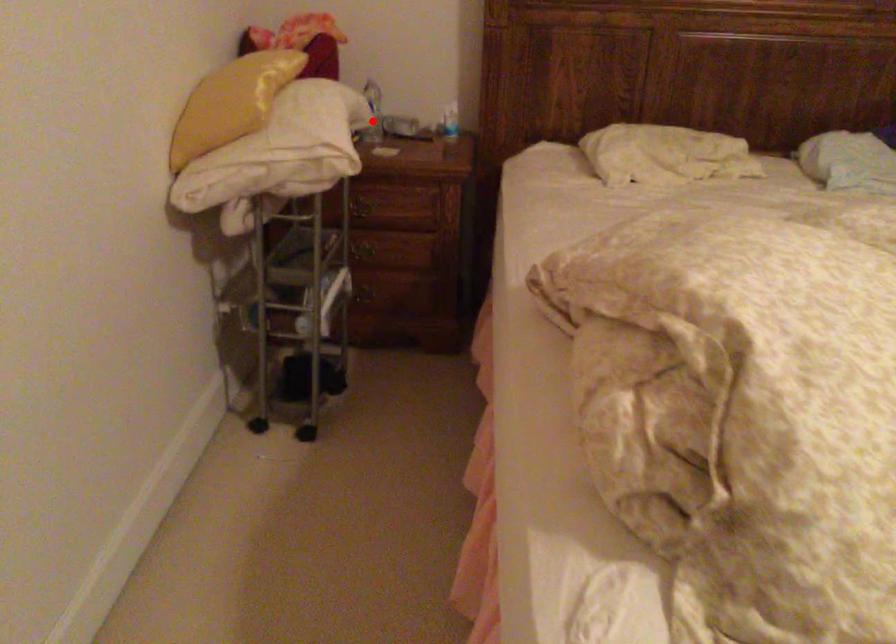
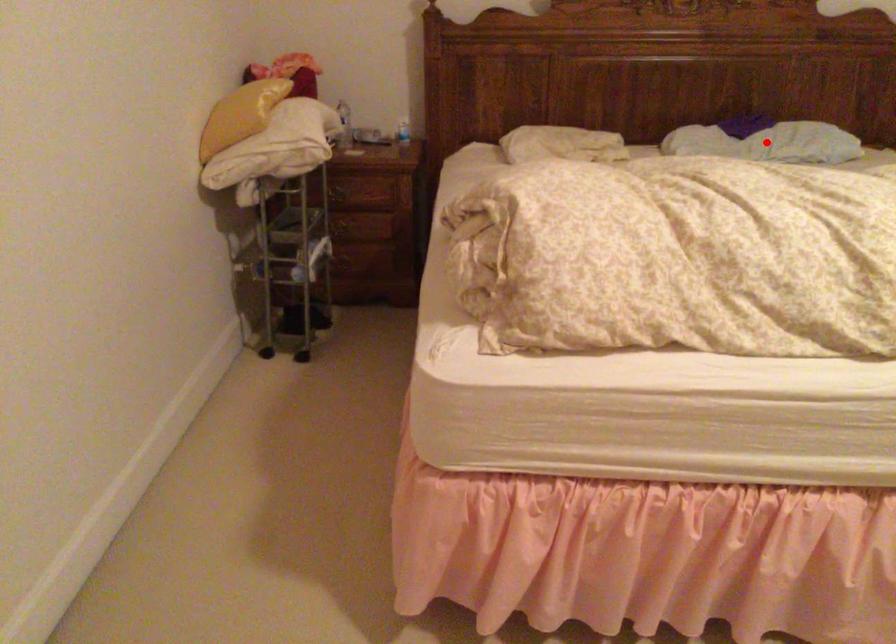
I am providing you with two images of the same scene from different viewpoints. A red point is marked on the first image and another point is marked on the second image. Are the points marked in image1 and image2 representing the same 3D position?

No